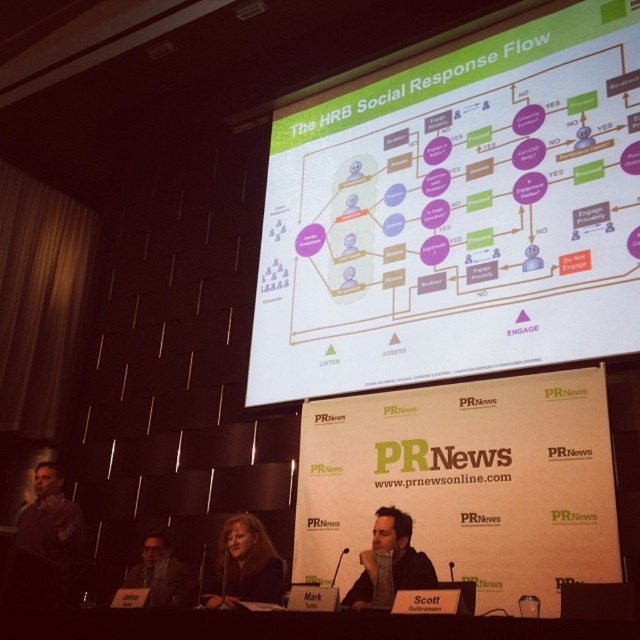
Question: Is dark brown hair at center in front of dark brown leather jacket at lower left?

Choices:
 (A) yes
 (B) no

Answer: (A)

Question: Which object is farther from the camera taking this photo?

Choices:
 (A) white paper at upper center
 (B) matte black suit at center
 (C) dark gray suit at lower left

Answer: (A)

Question: Which of these objects is positioned farthest from the matte black suit at center?

Choices:
 (A) dark brown hair at center
 (B) dark gray suit at lower left
 (C) white paper at upper center
 (D) dark brown leather jacket at lower left

Answer: (D)

Question: Can you confirm if dark brown hair at center is thinner than matte black suit at center?

Choices:
 (A) no
 (B) yes

Answer: (A)

Question: Can you confirm if white paper at upper center is bigger than dark brown hair at center?

Choices:
 (A) yes
 (B) no

Answer: (A)

Question: Considering the real-world distances, which object is farthest from the dark brown leather jacket at lower left?

Choices:
 (A) matte black suit at center
 (B) dark brown hair at center
 (C) white paper at upper center

Answer: (C)